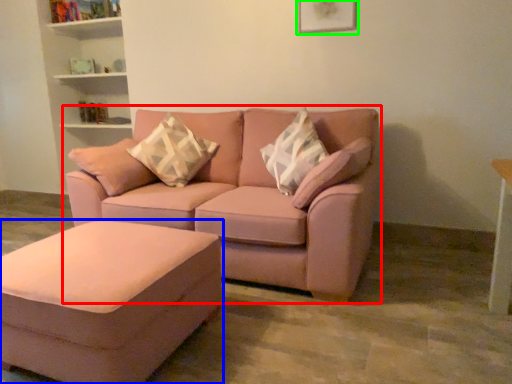
Question: Which object is the farthest from studio couch (highlighted by a red box)? Choose among these: table (highlighted by a blue box) or picture frame (highlighted by a green box).

Choices:
 (A) table
 (B) picture frame

Answer: (B)